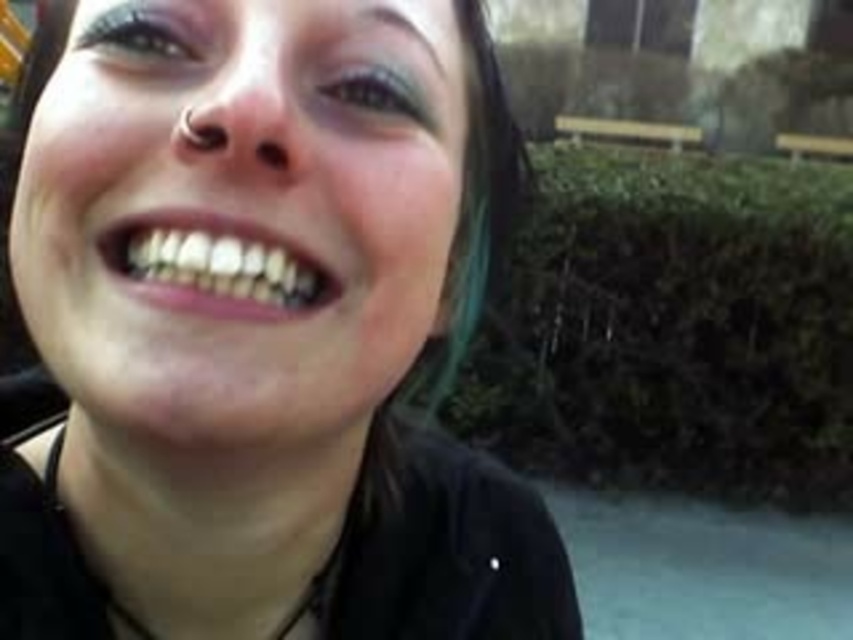
You are a photographer standing at the scene. You want to take a photo of the matte black face at center and the matte purple eye at upper left. If your camera can only focus on objects within 1.5 meters, will both objects be in focus?

The distance between the matte black face at center and the matte purple eye at upper left is 1.72 meters. Since the camera can only focus within 1.5 meters, the two objects are too far apart for both to be in focus simultaneously.